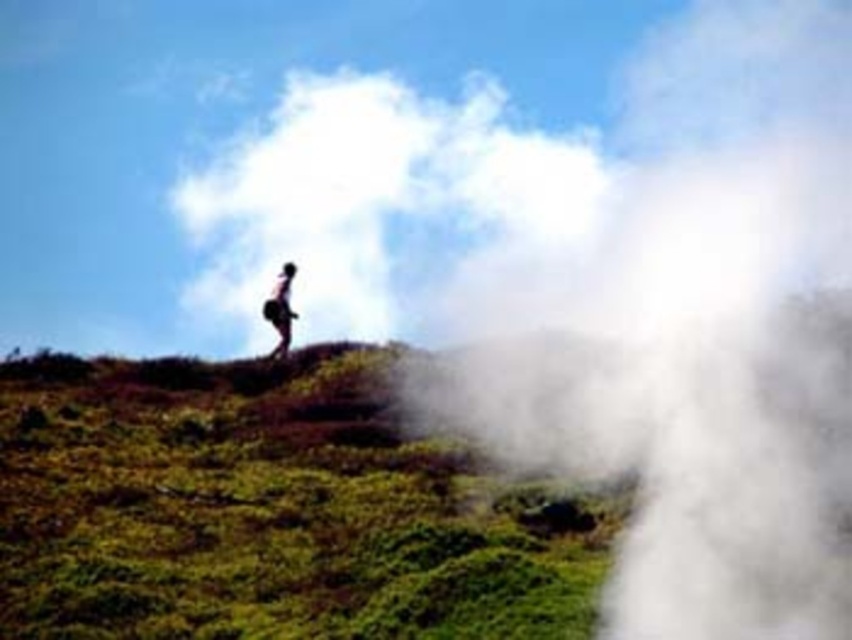
Is white fluffy cloud at upper center above light brown skin at center?

Correct, white fluffy cloud at upper center is located above light brown skin at center.

Is point (384, 244) less distant than point (273, 316)?

No, it is not.

Where is `white fluffy cloud at upper center`? The width and height of the screenshot is (852, 640). white fluffy cloud at upper center is located at coordinates (378, 202).

Is green grassy at center above light brown skin at center?

No.

Is point (281, 435) farther from camera compared to point (286, 340)?

No, (281, 435) is in front of (286, 340).

Is point (59, 412) farther from viewer compared to point (286, 346)?

No, (59, 412) is in front of (286, 346).

Identify the location of green grassy at center. This screenshot has height=640, width=852. (269, 509).

Is white foggy steam at upper right thinner than light brown skin at center?

No.

Consider the image. Can you confirm if white foggy steam at upper right is positioned to the left of light brown skin at center?

In fact, white foggy steam at upper right is to the right of light brown skin at center.

Find the location of `white foggy steam at upper right`. white foggy steam at upper right is located at coordinates (695, 333).